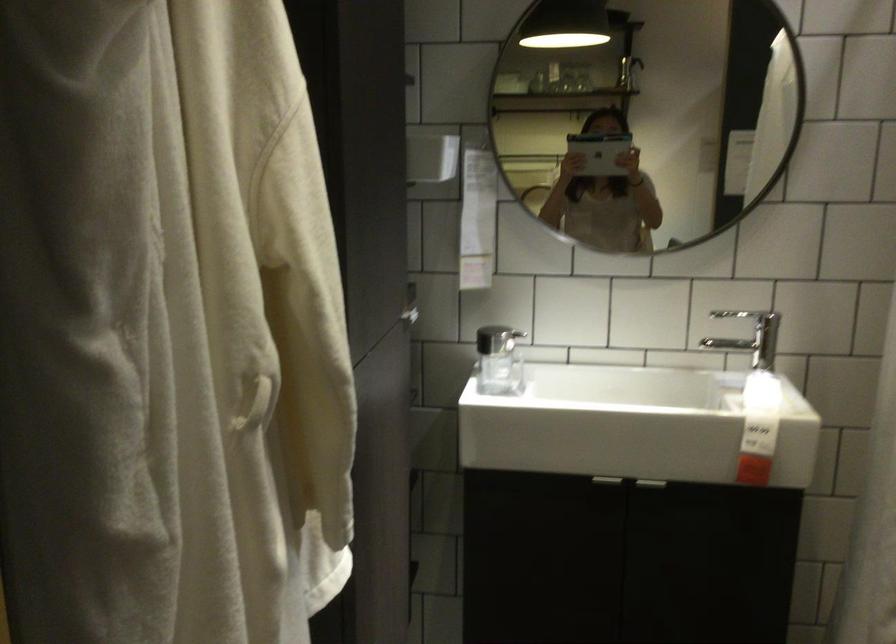
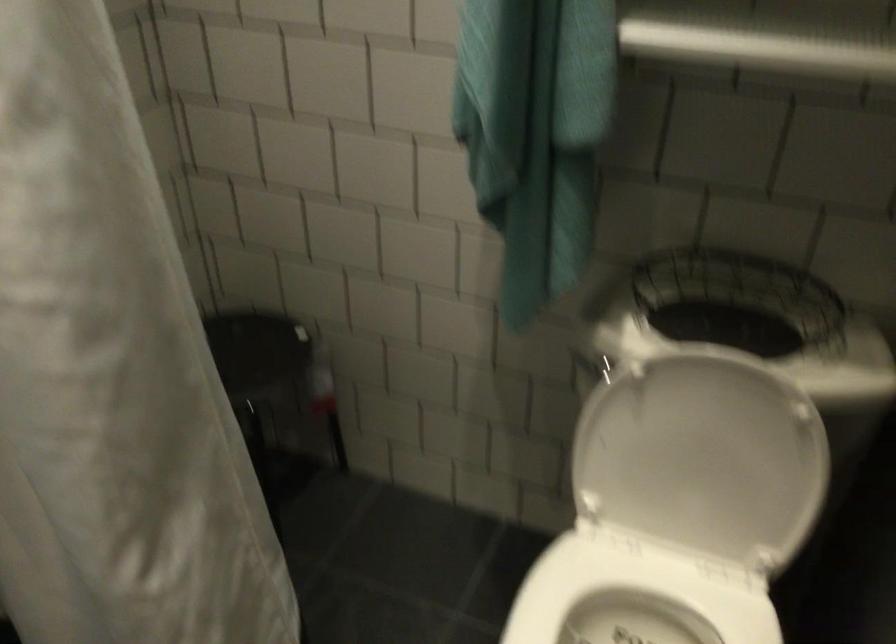
The first image is from the beginning of the video and the second image is from the end. How did the camera likely rotate when shooting the video?

The rotation direction of the camera is right-down.